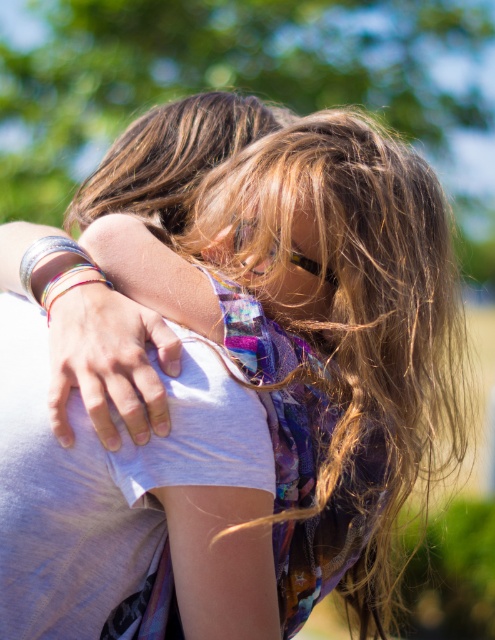
Question: Does metallic silver bracelet at upper left appear on the right side of brown shiny hair at upper center?

Choices:
 (A) no
 (B) yes

Answer: (A)

Question: Which object is closer to the camera taking this photo?

Choices:
 (A) brown shiny hair at upper center
 (B) clear plastic goggles at center

Answer: (B)

Question: Can you confirm if brown shiny hair at upper center is smaller than clear plastic goggles at center?

Choices:
 (A) yes
 (B) no

Answer: (B)

Question: Does metallic silver bracelet at upper left appear over brown shiny hair at upper center?

Choices:
 (A) no
 (B) yes

Answer: (A)

Question: Which point is closer to the camera taking this photo?

Choices:
 (A) (201, 141)
 (B) (318, 269)
 (C) (134, 371)

Answer: (C)

Question: Based on their relative distances, which object is farther from the clear plastic goggles at center?

Choices:
 (A) metallic silver bracelet at upper left
 (B) brown shiny hair at upper center

Answer: (B)